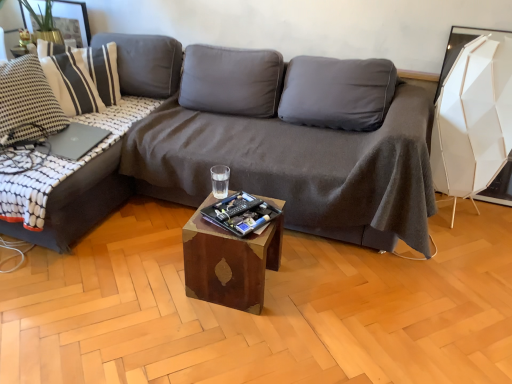
Question: Choose the correct answer: Is dark gray fabric couch at left, the 2th studio couch when ordered from right to left, inside wooden cube at center or outside it?

Choices:
 (A) outside
 (B) inside

Answer: (A)

Question: Is dark gray fabric couch at left, arranged as the first studio couch when viewed from the left, wider or thinner than wooden cube at center?

Choices:
 (A) thin
 (B) wide

Answer: (B)

Question: Estimate the real-world distances between objects in this image. Which object is closer to the white textured pillow at upper left?

Choices:
 (A) slate gray matte laptop at left
 (B) green leafy plant at upper left
 (C) wooden cube at center
 (D) dark gray fabric couch at left, arranged as the first studio couch when viewed from the left
 (E) dark gray fabric couch at center, placed as the 1th studio couch when sorted from right to left

Answer: (B)

Question: Which object is the farthest from the dark gray fabric couch at center, placed as the 1th studio couch when sorted from right to left?

Choices:
 (A) dark gray fabric couch at left, arranged as the first studio couch when viewed from the left
 (B) green leafy plant at upper left
 (C) wooden cube at center
 (D) slate gray matte laptop at left
 (E) white textured pillow at upper left

Answer: (B)